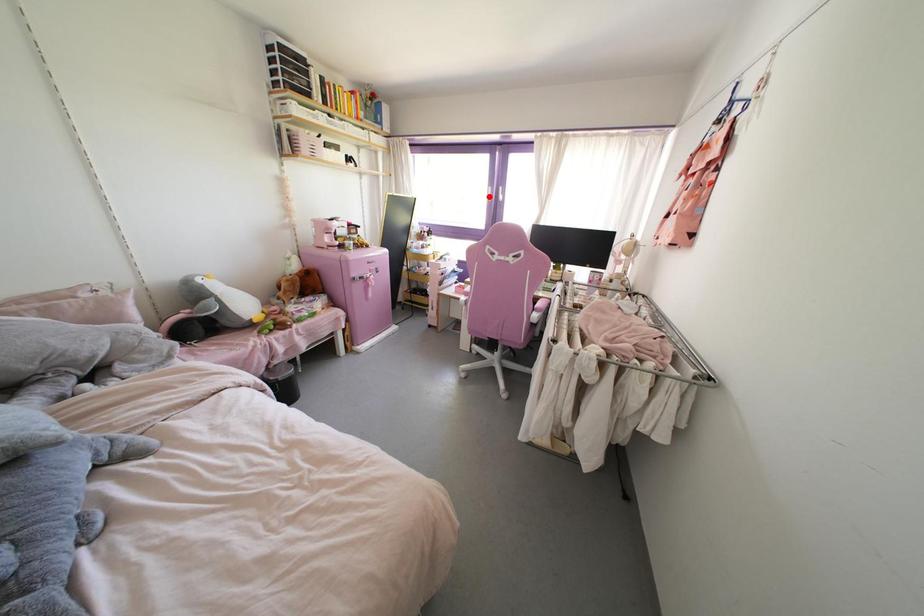
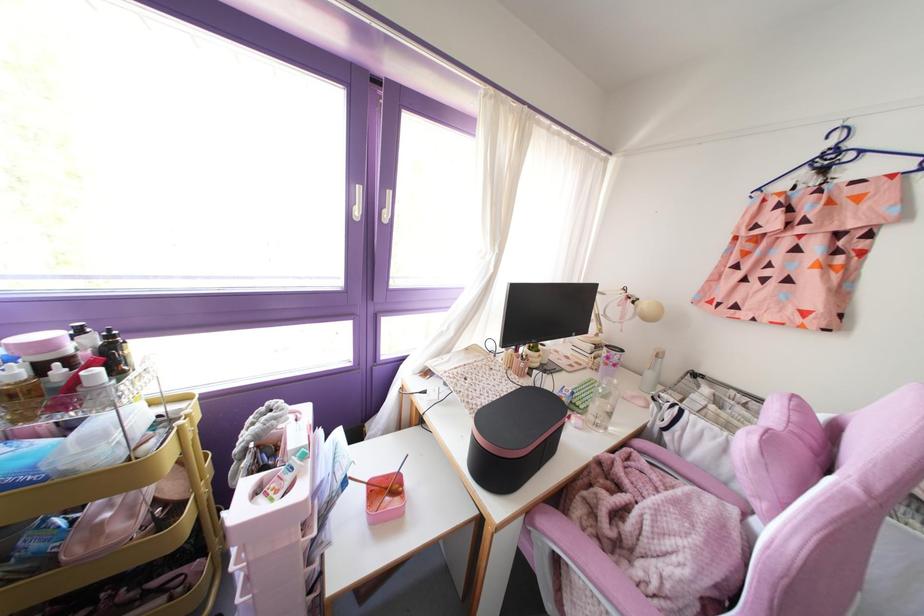
In the second image, find the point that corresponds to the highlighted location in the first image.

(357, 212)